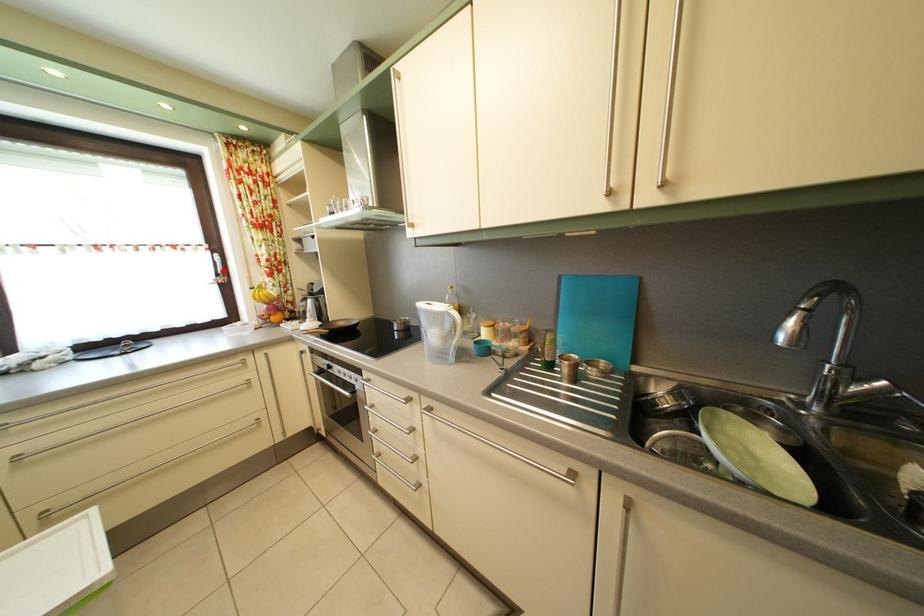
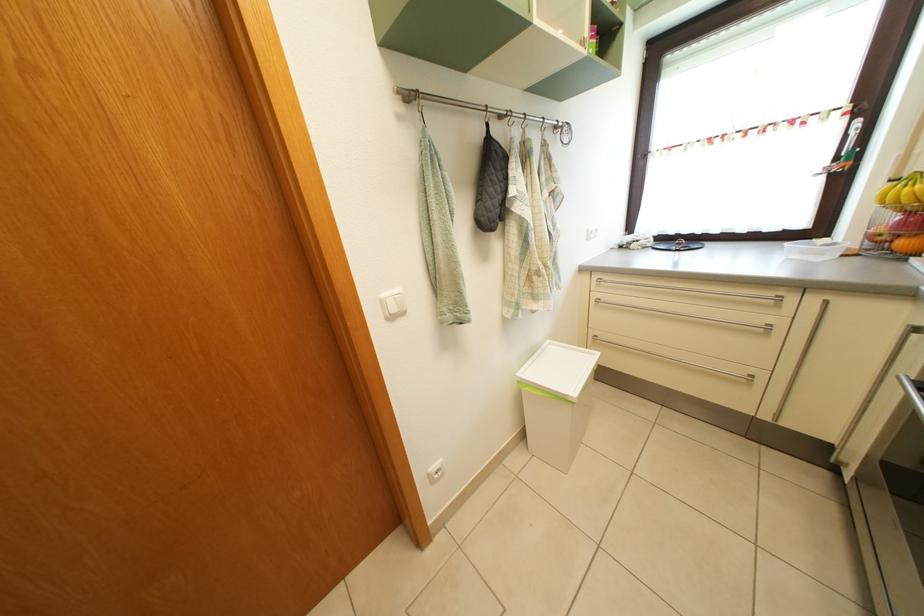
Question: I am providing you with two images of the same scene from different viewpoints. In image1, a red point is highlighted. Considering the same 3D point in image2, which of the following is correct?

Choices:
 (A) It is closer
 (B) It is farther

Answer: (B)